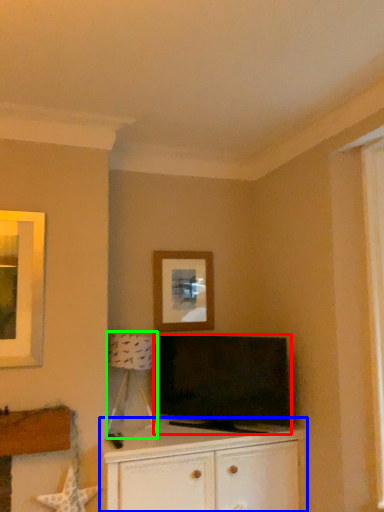
Question: Which is farther away from television (highlighted by a red box)? cabinetry (highlighted by a blue box) or lamp (highlighted by a green box)?

Choices:
 (A) cabinetry
 (B) lamp

Answer: (B)